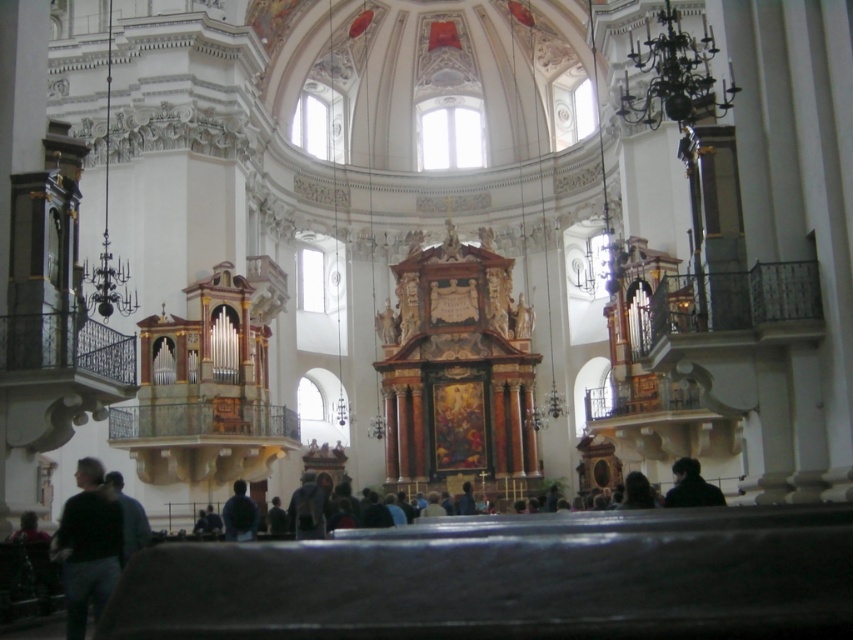
You are standing in the church and want to see the people wearing the dark blue shirt at lower center and the dark fabric jacket at lower right. Which one is more visible to you?

The dark blue shirt at lower center is behind the dark fabric jacket at lower right, so the dark fabric jacket at lower right is more visible.

You are a photographer standing at the entrance of the church. You want to take a picture of the dark fabric jacket at lower right and the dark blue shirt at lower center. Which one should you zoom in on to capture more details of the clothing item?

The dark fabric jacket at lower right has a lesser width compared to the dark blue shirt at lower center, so you should zoom in on the dark blue shirt at lower center to capture more details since it is wider and occupies more space in the frame.